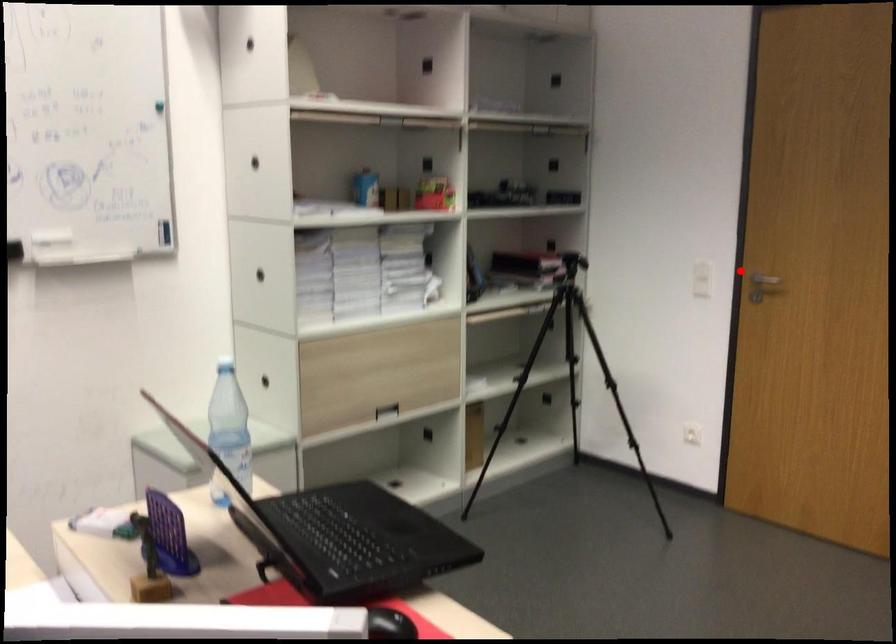
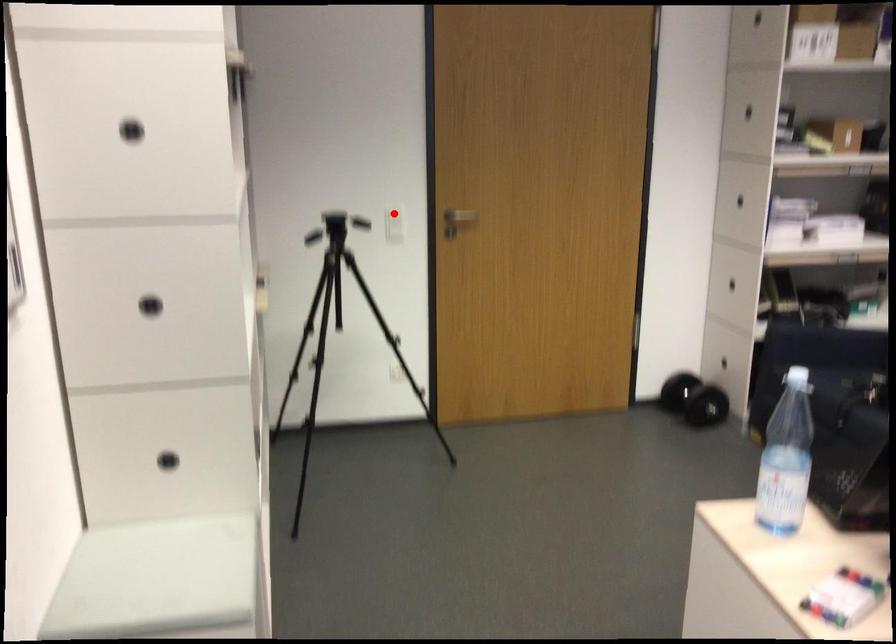
I am providing you with two images of the same scene from different viewpoints. A red point is marked on the first image and another point is marked on the second image. Do the highlighted points in image1 and image2 indicate the same real-world spot?

Yes